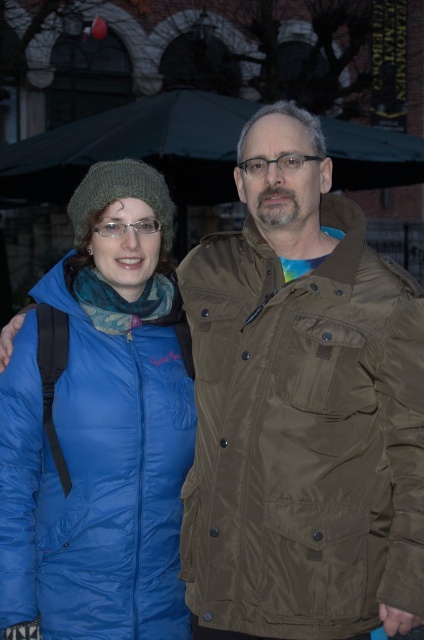
Question: Among these objects, which one is farthest from the camera?

Choices:
 (A) olive green fabric jacket at right
 (B) matte blue puffer jacket at center

Answer: (A)

Question: Considering the relative positions of olive green fabric jacket at right and matte blue puffer jacket at center in the image provided, where is olive green fabric jacket at right located with respect to matte blue puffer jacket at center?

Choices:
 (A) right
 (B) left

Answer: (A)

Question: Does olive green fabric jacket at right appear on the right side of matte blue puffer jacket at center?

Choices:
 (A) no
 (B) yes

Answer: (B)

Question: Which point appears farthest from the camera in this image?

Choices:
 (A) (142, 625)
 (B) (315, 374)

Answer: (B)

Question: Is olive green fabric jacket at right positioned at the back of matte blue puffer jacket at center?

Choices:
 (A) no
 (B) yes

Answer: (B)

Question: Which of the following is the farthest from the observer?

Choices:
 (A) (19, 369)
 (B) (254, 392)

Answer: (A)